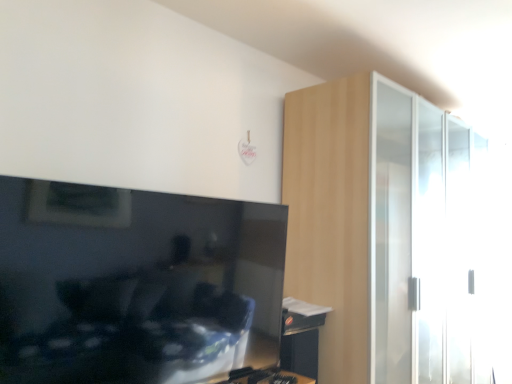
Question: Based on their sizes in the image, would you say wooden table at lower right is bigger or smaller than matte black tv at left?

Choices:
 (A) small
 (B) big

Answer: (A)

Question: Considering the positions of point (310, 360) and point (53, 203), is point (310, 360) closer or farther from the camera than point (53, 203)?

Choices:
 (A) farther
 (B) closer

Answer: (A)

Question: Considering the real-world distances, which object is farthest from the light wood dresser at right?

Choices:
 (A) wooden table at lower right
 (B) matte black tv at left

Answer: (B)

Question: Estimate the real-world distances between objects in this image. Which object is farther from the matte black tv at left?

Choices:
 (A) light wood dresser at right
 (B) wooden table at lower right

Answer: (A)